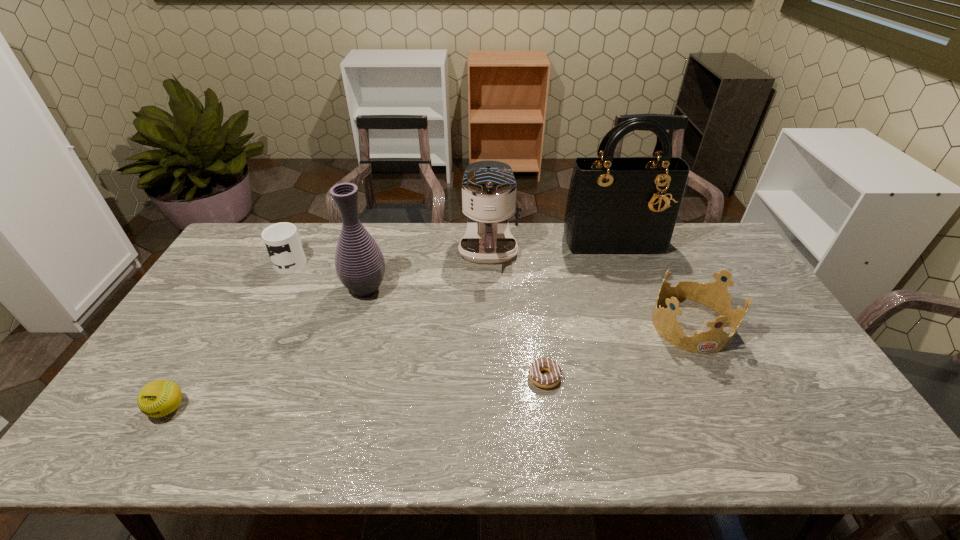
Find the location of a particular element. The height and width of the screenshot is (540, 960). free spot between the mug and the second shortest object is located at coordinates (230, 335).

Identify which object is located as the second nearest to the sixth object from right to left. Please provide its 2D coordinates. Your answer should be formatted as a tuple, i.e. [(x, y)], where the tuple contains the x and y coordinates of a point satisfying the conditions above.

[(158, 398)]

Identify which object is the fifth closest to the doughnut. Please provide its 2D coordinates. Your answer should be formatted as a tuple, i.e. [(x, y)], where the tuple contains the x and y coordinates of a point satisfying the conditions above.

[(283, 241)]

Where is `free spot that satisfies the following two spatial constraints: 1. on the front-facing side of the coffee maker; 2. on the right side of the doughnut`? free spot that satisfies the following two spatial constraints: 1. on the front-facing side of the coffee maker; 2. on the right side of the doughnut is located at coordinates click(x=492, y=377).